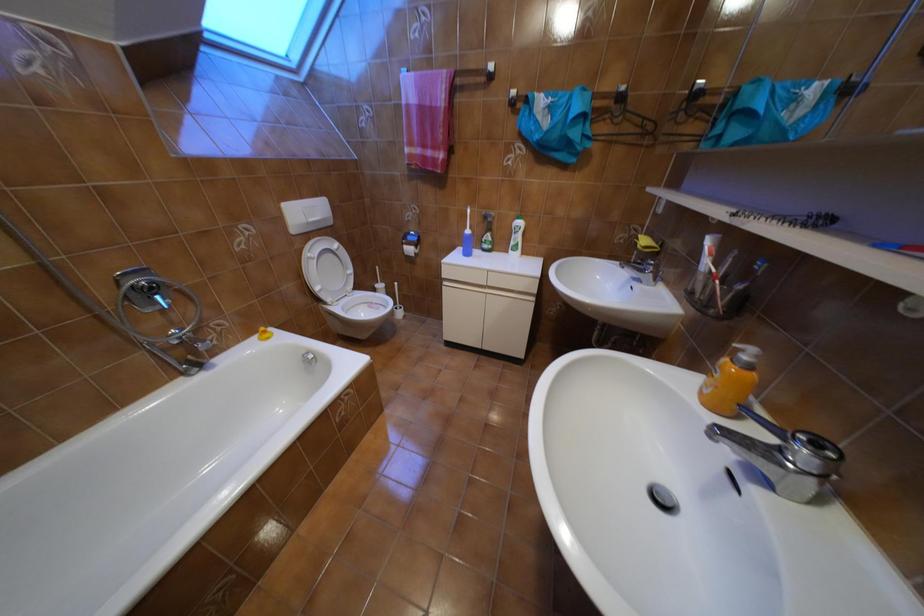
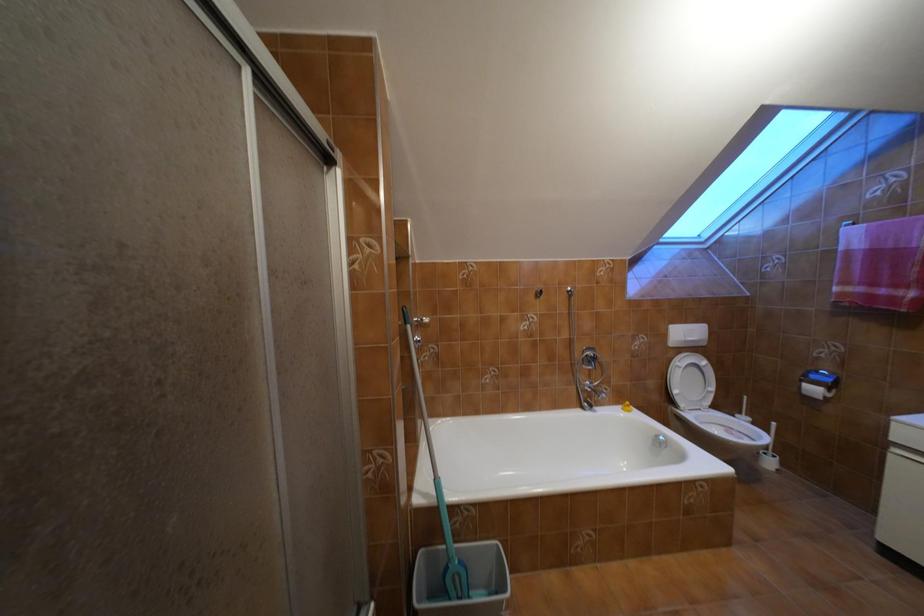
Question: The first image is from the beginning of the video and the second image is from the end. How did the camera likely rotate when shooting the video?

Choices:
 (A) Left
 (B) Right
 (C) Up
 (D) Down

Answer: (A)